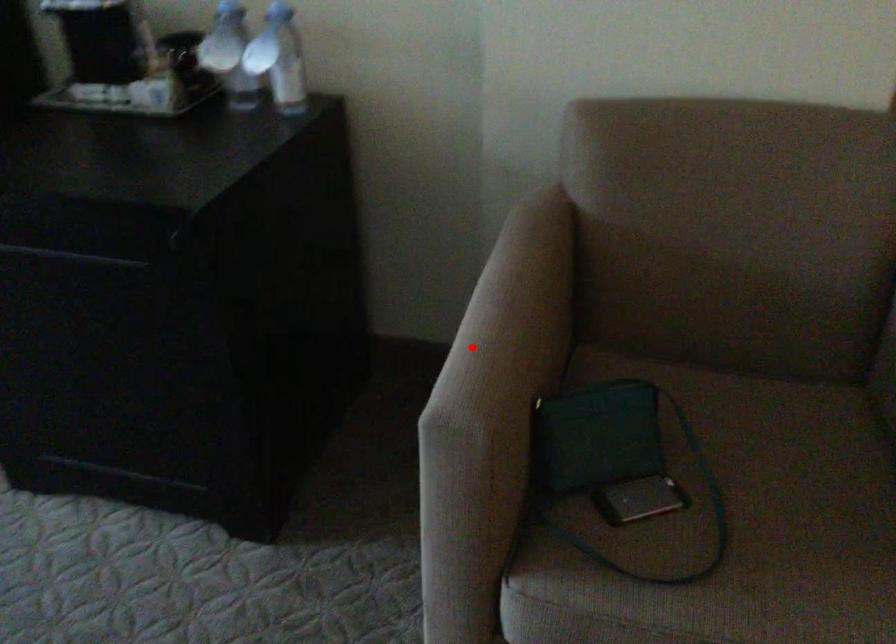
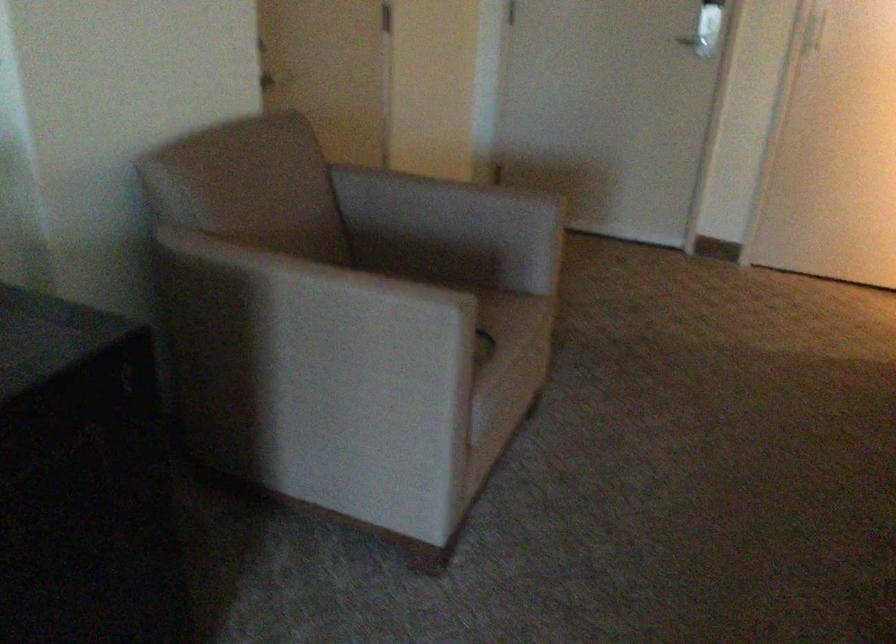
The point at the highlighted location is marked in the first image. Where is the corresponding point in the second image?

(314, 325)